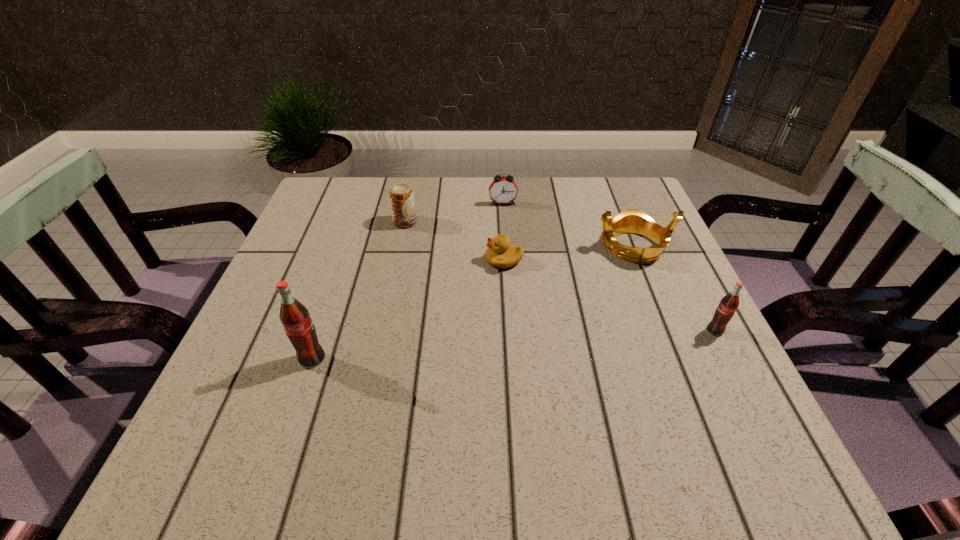
The width and height of the screenshot is (960, 540). What are the coordinates of `vacant space located 0.220m on the clock face of the farthest object` in the screenshot? It's located at (507, 260).

I want to click on vacant area situated on the front of the beer can, so click(x=383, y=325).

I want to click on vacant space located 0.190m at the front emblem of the tiara, so click(516, 247).

Where is `vacant area located at the front emblem of the tiara`? vacant area located at the front emblem of the tiara is located at coordinates (540, 247).

At what (x,y) coordinates should I click in order to perform the action: click on vacant space situated 0.260m at the front emblem of the tiara. Please return your answer as a coordinate pair (x, y). Looking at the image, I should click on (487, 247).

This screenshot has height=540, width=960. What are the coordinates of `free spot located 0.130m on the front-facing side of the shortest object` in the screenshot? It's located at (429, 260).

You are a GUI agent. You are given a task and a screenshot of the screen. Output one action in this format:
    pyautogui.click(x=<x>, y=<y>)
    Task: Click on the vacant space located 0.070m on the front-facing side of the shortest object
    Image resolution: width=960 pixels, height=540 pixels.
    Given the screenshot: What is the action you would take?
    pyautogui.click(x=455, y=260)

Locate an element on the screen. The image size is (960, 540). blank area located on the front-facing side of the shortest object is located at coordinates (417, 260).

Image resolution: width=960 pixels, height=540 pixels. I want to click on alarm clock positioned at the far edge, so click(503, 190).

The height and width of the screenshot is (540, 960). I want to click on beer can present at the far edge, so click(401, 197).